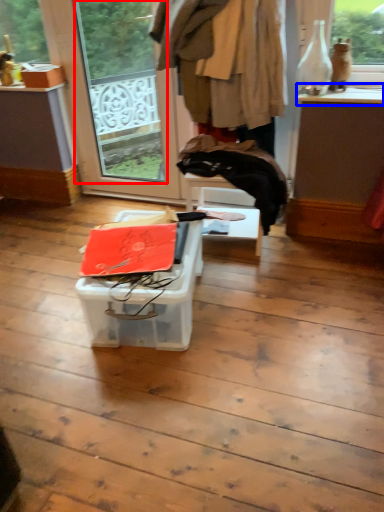
Question: Which object is closer to the camera taking this photo, window screen (highlighted by a red box) or window sill (highlighted by a blue box)?

Choices:
 (A) window screen
 (B) window sill

Answer: (B)